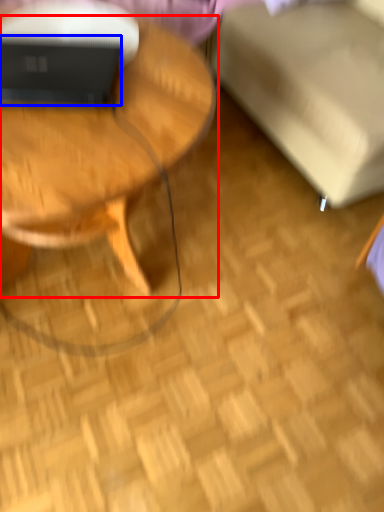
Question: Which object appears farthest to the camera in this image, coffee table (highlighted by a red box) or laptop (highlighted by a blue box)?

Choices:
 (A) coffee table
 (B) laptop

Answer: (B)